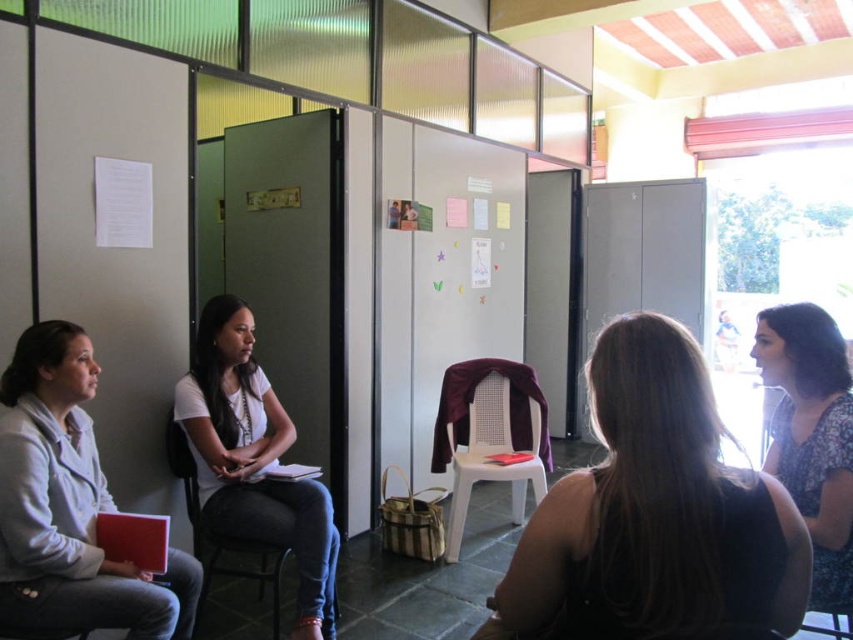
Between dark brown hair at center and floral dress at right, which one has less height?

With less height is dark brown hair at center.

In the scene shown: Which is above, dark brown hair at center or floral dress at right?

dark brown hair at center is above.

Measure the distance between point (552, 522) and camera.

Point (552, 522) and camera are 1.13 meters apart.

Identify the location of dark brown hair at center. (654, 515).

Is light gray fabric jacket at left taller than black plastic chair at center?

Correct, light gray fabric jacket at left is much taller as black plastic chair at center.

Is point (62, 420) more distant than point (200, 602)?

No, (62, 420) is in front of (200, 602).

The height and width of the screenshot is (640, 853). Describe the element at coordinates (68, 506) in the screenshot. I see `light gray fabric jacket at left` at that location.

Find the location of a particular element. The width and height of the screenshot is (853, 640). light gray fabric jacket at left is located at coordinates (68, 506).

Is point (848, 396) positioned behind point (438, 422)?

That is False.

Which of these two, floral dress at right or white plastic chair at center, stands shorter?

With less height is floral dress at right.

Does point (833, 604) lie in front of point (511, 468)?

Yes.

In order to click on floral dress at right in this screenshot , I will do `click(811, 436)`.